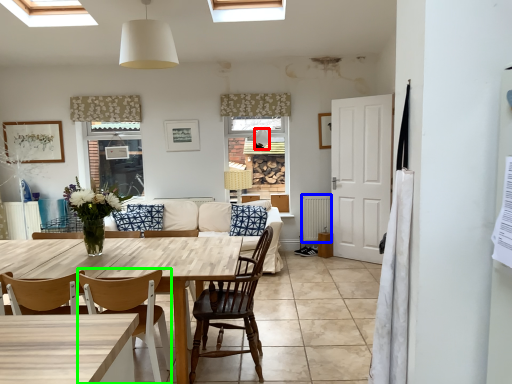
Question: Considering the real-world distances, which object is farthest from lamp (highlighted by a red box)? radiator (highlighted by a blue box) or chair (highlighted by a green box)?

Choices:
 (A) radiator
 (B) chair

Answer: (B)